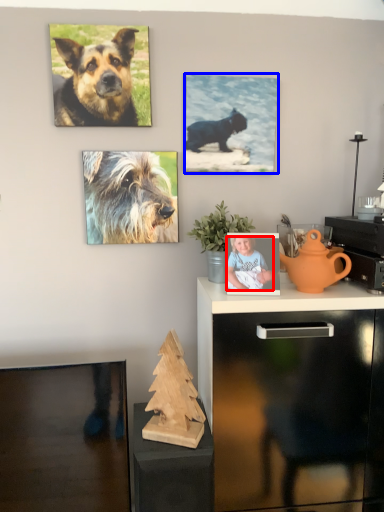
Question: Which object is closer to the camera taking this photo, person (highlighted by a red box) or picture frame (highlighted by a blue box)?

Choices:
 (A) person
 (B) picture frame

Answer: (A)